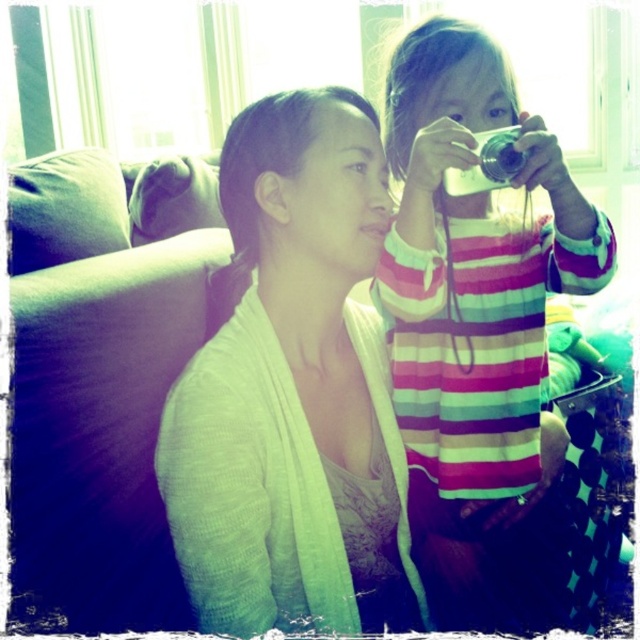
You are a photographer trying to capture a photo of the green textured sweater at center and the striped fabric shirt at upper right. Which one should you focus on first if you want to ensure both are in focus?

The green textured sweater at center is closer to the viewer than the striped fabric shirt at upper right, so you should focus on the green textured sweater at center first to ensure both are in focus.

You are standing in the room and want to place a decorative item on the green textured sweater at center. What is the exact coordinate where you should place it?

The green textured sweater at center is located at point (292, 390), so you should place the decorative item there.

You are a photographer trying to capture a candid shot of the two subjects. Since you don not want to disturb them, you decide to use the mirror reflection to frame your shot. Which object from the scene should you focus on first to ensure the reflection includes both the green textured sweater at center and the striped fabric shirt at upper right?

You should focus on the striped fabric shirt at upper right first because the green textured sweater at center is located below it, ensuring the reflection captures both when centered on the higher positioned item.